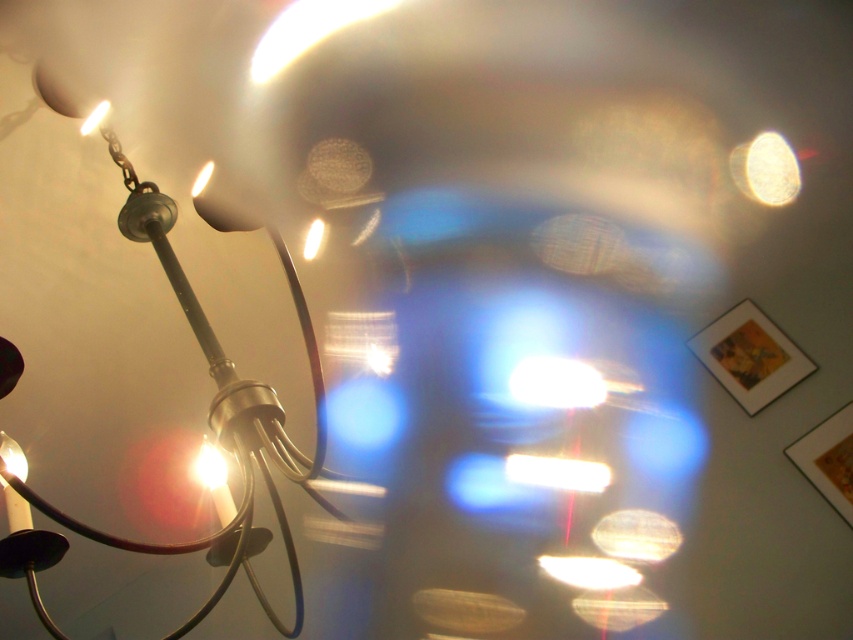
Question: In this image, where is white glossy tube at center located relative to matte white bulb at upper left?

Choices:
 (A) above
 (B) below

Answer: (B)

Question: Estimate the real-world distances between objects in this image. Which object is farther from the white glossy light bulb at center?

Choices:
 (A) matte white bulb at upper left
 (B) white glossy light at center

Answer: (A)

Question: Which object appears farthest from the camera in this image?

Choices:
 (A) white glossy light bulb at center
 (B) white glossy light at center

Answer: (A)

Question: Can you confirm if translucent glass sphere at upper right is positioned to the left of matte white bulb at upper left?

Choices:
 (A) no
 (B) yes

Answer: (A)

Question: Which point appears farthest from the camera in this image?

Choices:
 (A) (747, 144)
 (B) (567, 378)

Answer: (B)

Question: Can you confirm if translucent glass sphere at upper right is smaller than matte white bulb at upper left?

Choices:
 (A) yes
 (B) no

Answer: (B)